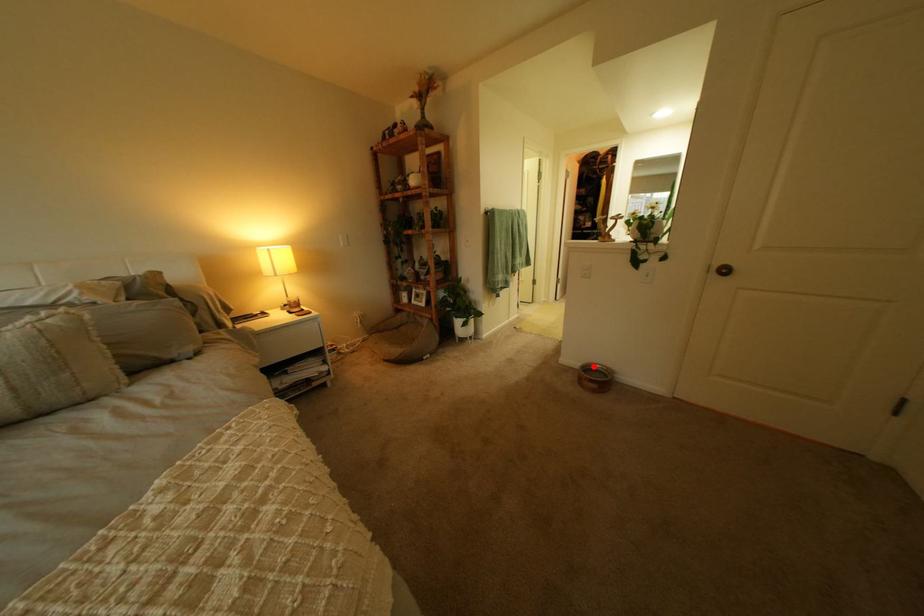
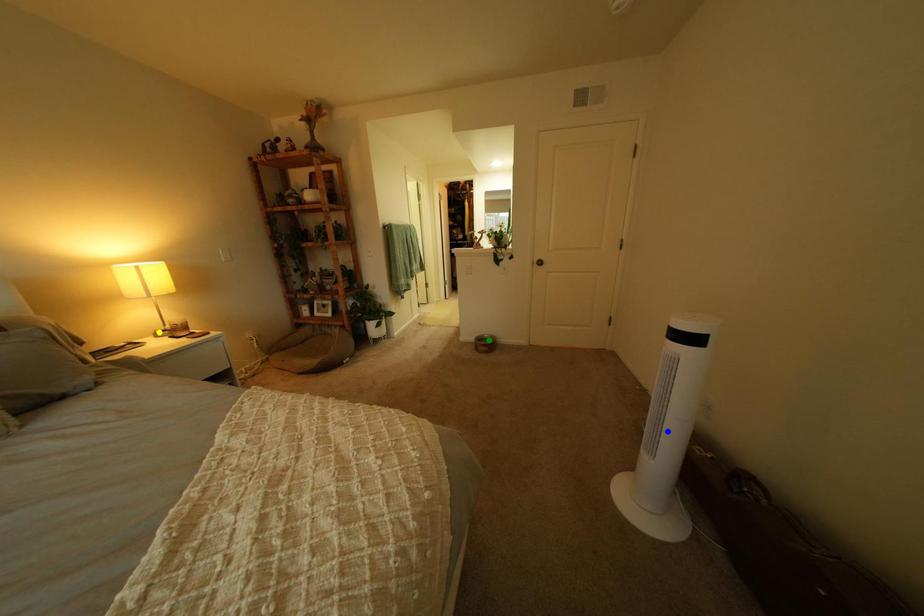
Question: I am providing you with two images of the same scene from different viewpoints. A red point is marked on the first image. You are given multiple points on the second image. Which point in image 2 is actually the same real-world point as the red point in image 1?

Choices:
 (A) green point
 (B) yellow point
 (C) blue point

Answer: (A)